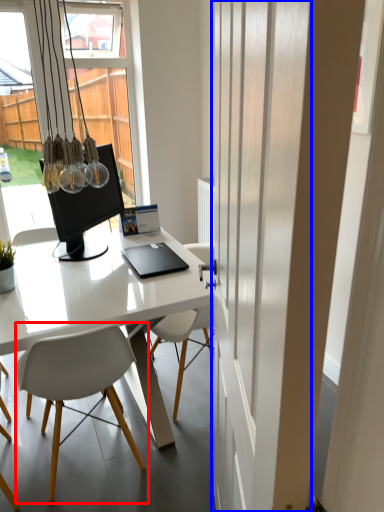
Question: Which object appears closest to the camera in this image, chair (highlighted by a red box) or screen door (highlighted by a blue box)?

Choices:
 (A) chair
 (B) screen door

Answer: (B)